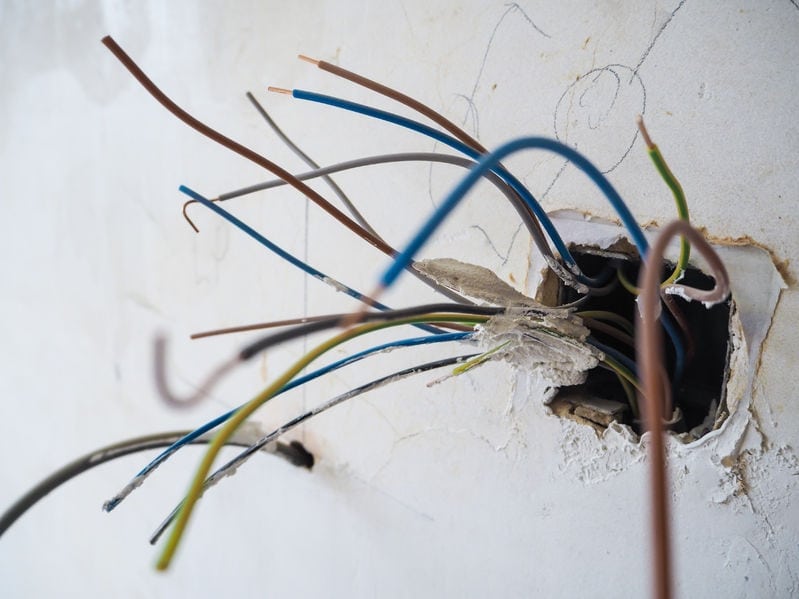
Image resolution: width=799 pixels, height=599 pixels. I want to click on white drywall, so click(96, 276), click(436, 510), click(690, 57).